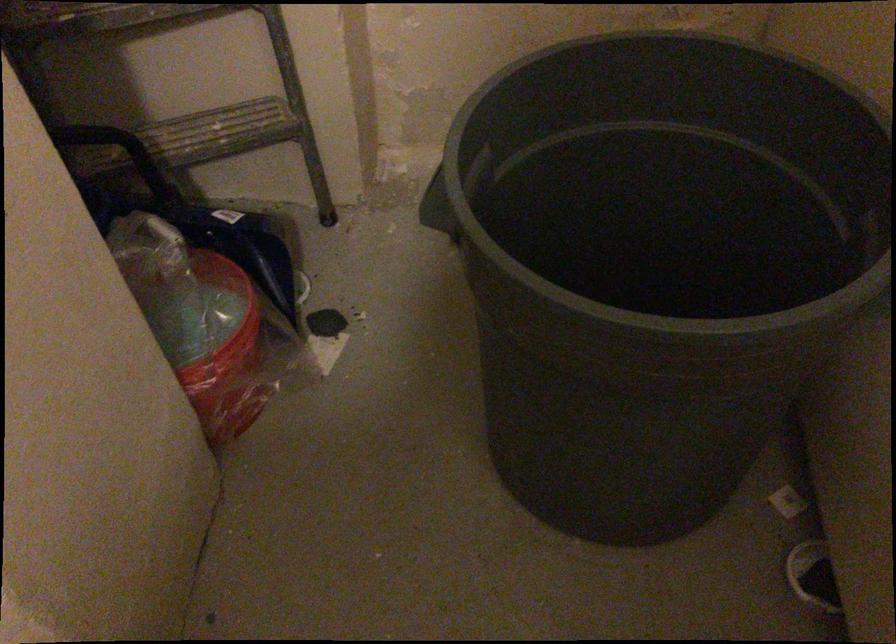
Describe the element at coordinates (116, 153) in the screenshot. The image size is (896, 644). I see `a black dustpan handle` at that location.